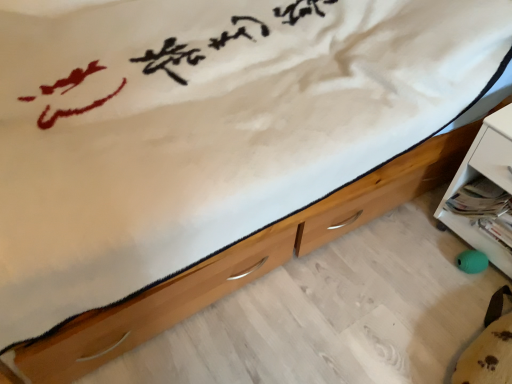
At what (x,y) coordinates should I click in order to perform the action: click on vacant position to the left of white glossy cabinet at lower right. Please return your answer as a coordinate pair (x, y). The height and width of the screenshot is (384, 512). Looking at the image, I should click on (409, 255).